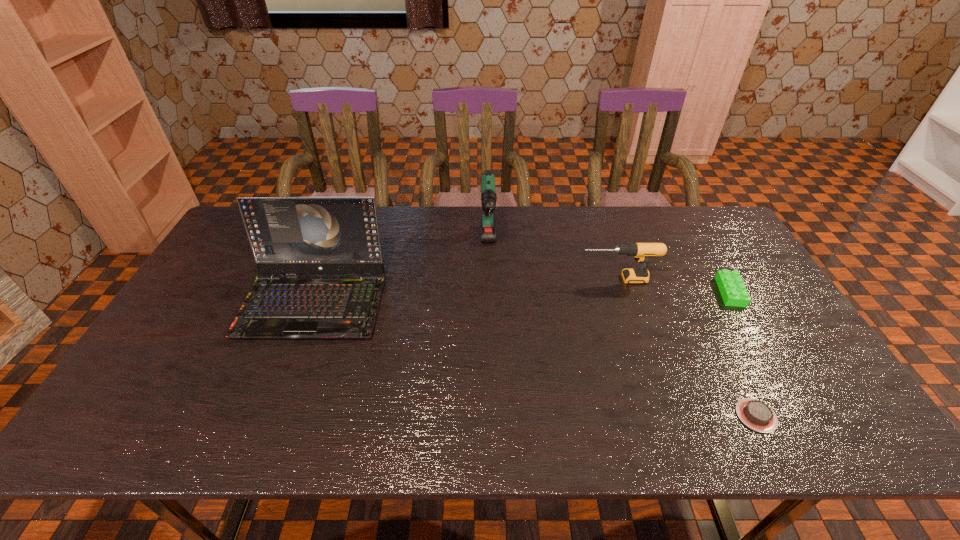
At what (x,y) coordinates should I click in order to perform the action: click on vacant space at the near edge of the desktop. Please return your answer as a coordinate pair (x, y). Looking at the image, I should click on (661, 431).

Where is `vacant space at the left edge of the desktop`? The image size is (960, 540). vacant space at the left edge of the desktop is located at coordinates click(x=241, y=275).

At what (x,y) coordinates should I click in order to perform the action: click on free spot at the far right corner of the desktop. Please return your answer as a coordinate pair (x, y). The image size is (960, 540). Looking at the image, I should click on (703, 232).

At what (x,y) coordinates should I click in order to perform the action: click on vacant area that lies between the laptop computer and the farther drill. Please return your answer as a coordinate pair (x, y). The image size is (960, 540). Looking at the image, I should click on (401, 274).

Locate an element on the screen. vacant space that's between the fourth tallest object and the fourth object from right to left is located at coordinates (610, 269).

Identify the location of vacant area that lies between the fourth shortest object and the shortest object. (622, 331).

The width and height of the screenshot is (960, 540). I want to click on free space between the second object from right to left and the second tallest object, so click(x=622, y=331).

This screenshot has height=540, width=960. In order to click on free spot between the rightmost object and the taller drill in this screenshot , I will do `click(610, 269)`.

Find the location of `vacant space in between the shorter drill and the taller drill`. vacant space in between the shorter drill and the taller drill is located at coordinates (553, 263).

At what (x,y) coordinates should I click in order to perform the action: click on vacant area that lies between the third shortest object and the rightmost object. Please return your answer as a coordinate pair (x, y). This screenshot has height=540, width=960. Looking at the image, I should click on (674, 286).